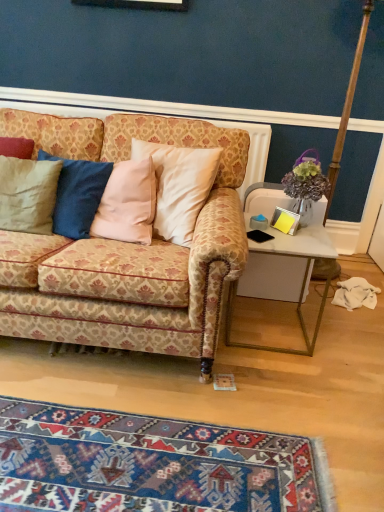
Question: From a real-world perspective, is white glossy desk at right below matte beige pillow at left?

Choices:
 (A) yes
 (B) no

Answer: (A)

Question: Is white glossy desk at right further to camera compared to matte beige pillow at left?

Choices:
 (A) yes
 (B) no

Answer: (B)

Question: Does white glossy desk at right turn towards matte beige pillow at left?

Choices:
 (A) yes
 (B) no

Answer: (B)

Question: Considering the relative sizes of white glossy desk at right and matte beige pillow at left in the image provided, is white glossy desk at right smaller than matte beige pillow at left?

Choices:
 (A) yes
 (B) no

Answer: (B)

Question: From a real-world perspective, is white glossy desk at right physically above matte beige pillow at left?

Choices:
 (A) no
 (B) yes

Answer: (A)

Question: Considering the relative positions of white glossy desk at right and matte beige pillow at left in the image provided, is white glossy desk at right to the right of matte beige pillow at left from the viewer's perspective?

Choices:
 (A) no
 (B) yes

Answer: (B)

Question: From a real-world perspective, is white glossy desk at right positioned over patterned fabric couch at center based on gravity?

Choices:
 (A) no
 (B) yes

Answer: (A)

Question: From a real-world perspective, is white glossy desk at right physically below patterned fabric couch at center?

Choices:
 (A) yes
 (B) no

Answer: (A)

Question: From the image's perspective, is white glossy desk at right over patterned fabric couch at center?

Choices:
 (A) yes
 (B) no

Answer: (B)

Question: Is white glossy desk at right smaller than patterned fabric couch at center?

Choices:
 (A) no
 (B) yes

Answer: (B)

Question: Could you tell me if white glossy desk at right is facing patterned fabric couch at center?

Choices:
 (A) yes
 (B) no

Answer: (B)

Question: Is white glossy desk at right closer to camera compared to patterned fabric couch at center?

Choices:
 (A) no
 (B) yes

Answer: (A)

Question: From a real-world perspective, is matte beige pillow at left located higher than white glossy desk at right?

Choices:
 (A) yes
 (B) no

Answer: (A)